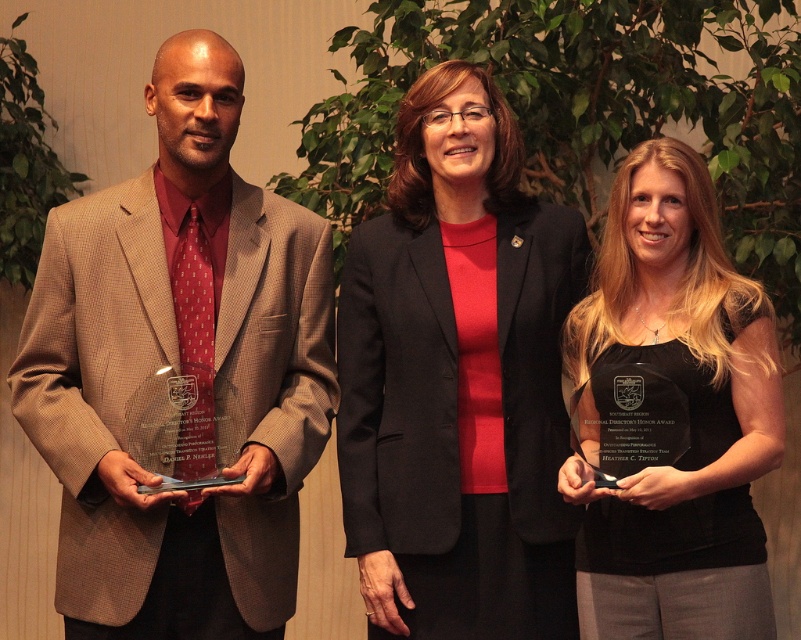
Can you confirm if matte brown suit at center is shorter than black glossy award at center?

In fact, matte brown suit at center may be taller than black glossy award at center.

Which is more to the right, matte brown suit at center or black glossy award at center?

Positioned to the right is black glossy award at center.

This screenshot has height=640, width=801. What do you see at coordinates (179, 374) in the screenshot?
I see `matte brown suit at center` at bounding box center [179, 374].

You are a GUI agent. You are given a task and a screenshot of the screen. Output one action in this format:
    pyautogui.click(x=<x>, y=<y>)
    Task: Click on the matte brown suit at center
    The image size is (801, 640).
    Given the screenshot: What is the action you would take?
    pyautogui.click(x=179, y=374)

Does matte brown suit at center have a lesser width compared to matte black blazer at center?

No.

Which of these two, matte brown suit at center or matte black blazer at center, stands taller?

With more height is matte brown suit at center.

Does point (123, 602) come behind point (449, 580)?

That is False.

Where is `matte brown suit at center`? The image size is (801, 640). matte brown suit at center is located at coordinates (179, 374).

Is point (445, 275) positioned before point (618, 512)?

That is False.

Does matte black blazer at center appear on the left side of black glossy award at center?

Indeed, matte black blazer at center is positioned on the left side of black glossy award at center.

What do you see at coordinates (457, 380) in the screenshot?
I see `matte black blazer at center` at bounding box center [457, 380].

At what (x,y) coordinates should I click in order to perform the action: click on matte black blazer at center. Please return your answer as a coordinate pair (x, y). Looking at the image, I should click on (457, 380).